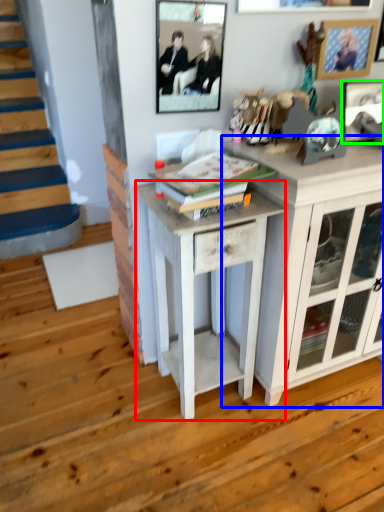
Question: Which object is positioned closest to table (highlighted by a red box)? Select from cabinetry (highlighted by a blue box) and picture frame (highlighted by a green box).

Choices:
 (A) cabinetry
 (B) picture frame

Answer: (A)